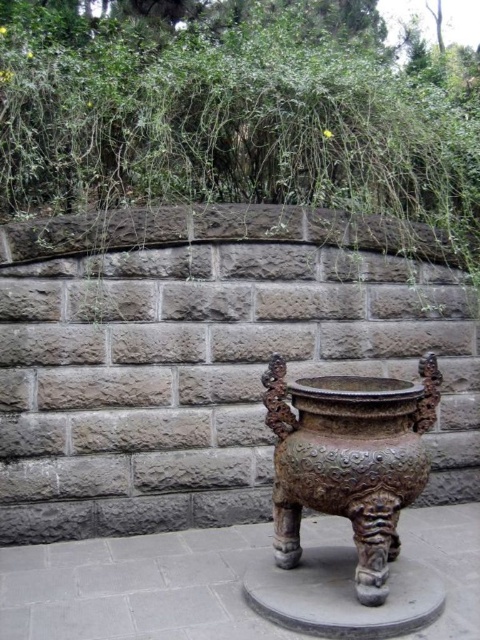
Question: Does green leafy vegetation at upper center lie behind bronze textured pot at center?

Choices:
 (A) yes
 (B) no

Answer: (A)

Question: Which point is closer to the camera?

Choices:
 (A) green leafy vegetation at upper center
 (B) bronze textured pot at center

Answer: (B)

Question: Which point appears closest to the camera in this image?

Choices:
 (A) (276, 417)
 (B) (288, 173)

Answer: (A)

Question: Is green leafy vegetation at upper center positioned in front of bronze textured pot at center?

Choices:
 (A) no
 (B) yes

Answer: (A)

Question: Where is green leafy vegetation at upper center located in relation to bronze textured pot at center in the image?

Choices:
 (A) above
 (B) below

Answer: (A)

Question: Which point is farther to the camera?

Choices:
 (A) green leafy vegetation at upper center
 (B) bronze textured pot at center

Answer: (A)